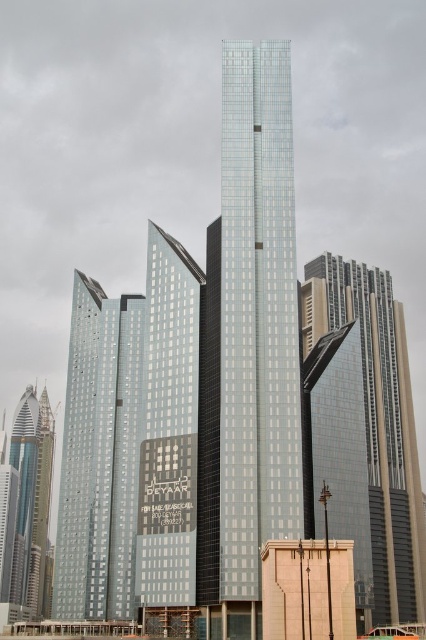
Question: Which point is closer to the camera?

Choices:
 (A) 374,570
 (B) 132,304

Answer: (B)

Question: Is glassy steel skyscraper at center thinner than glassy metallic skyscraper at center?

Choices:
 (A) yes
 (B) no

Answer: (A)

Question: Which point is closer to the camera?

Choices:
 (A) glassy metallic skyscraper at center
 (B) metallic glass skyscraper at left
 (C) glassy steel skyscraper at center
 (D) shiny silver skyscraper at left

Answer: (C)

Question: From the image, what is the correct spatial relationship of metallic glass skyscraper at left in relation to glassy metallic skyscraper at center?

Choices:
 (A) left
 (B) right

Answer: (A)

Question: Which object is the closest to the metallic glass skyscraper at left?

Choices:
 (A) glassy metallic skyscraper at center
 (B) glassy steel skyscraper at center

Answer: (B)

Question: Considering the relative positions of metallic glass skyscraper at left and glassy metallic skyscraper at center in the image provided, where is metallic glass skyscraper at left located with respect to glassy metallic skyscraper at center?

Choices:
 (A) below
 (B) above

Answer: (A)